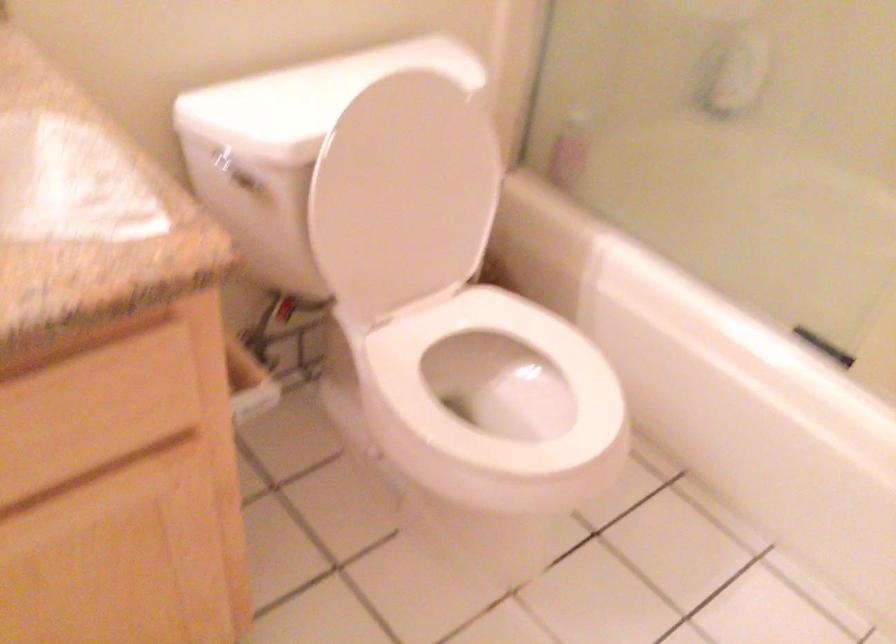
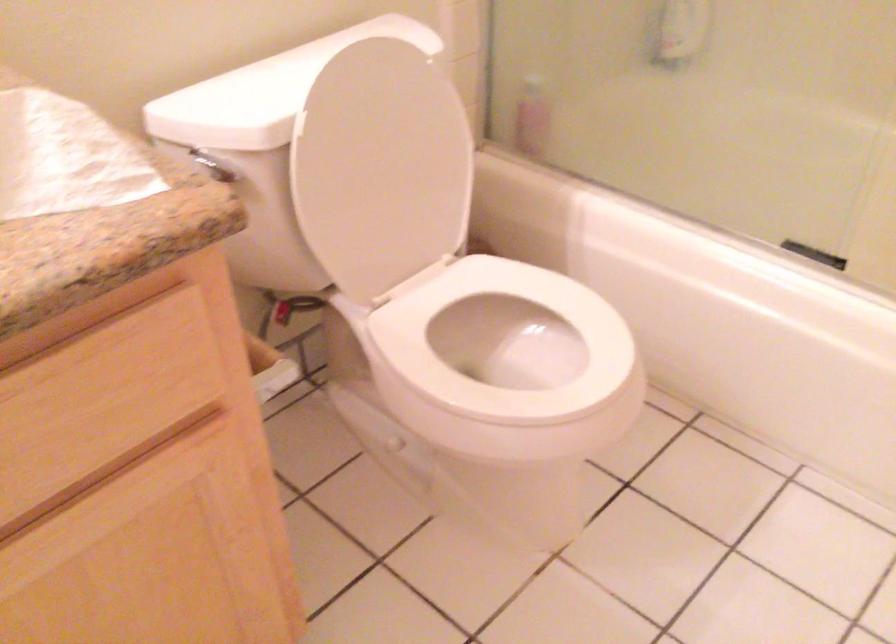
Find the pixel in the second image that matches (x=571, y=149) in the first image.

(533, 117)